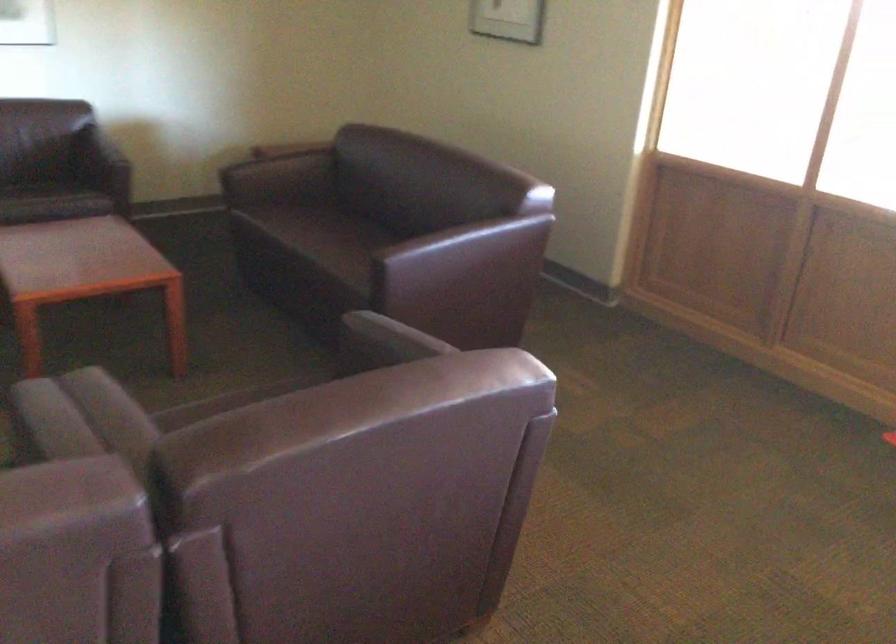
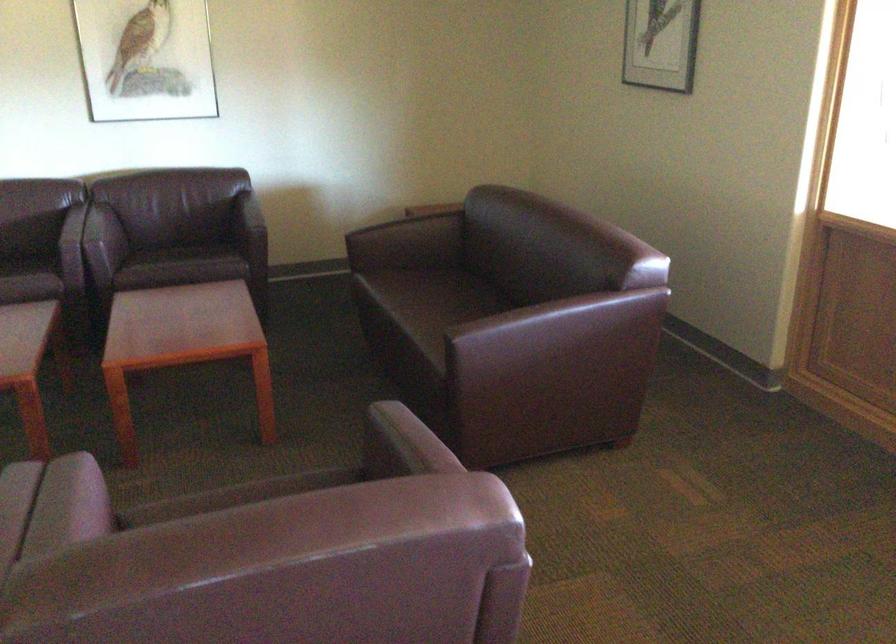
Where in the second image is the point corresponding to [479,260] from the first image?

(561, 341)